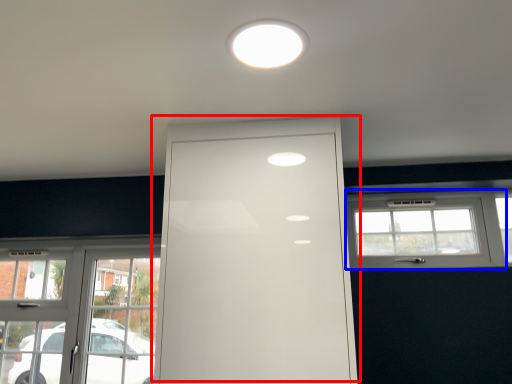
Question: Among these objects, which one is nearest to the camera, door (highlighted by a red box) or window (highlighted by a blue box)?

Choices:
 (A) door
 (B) window

Answer: (A)